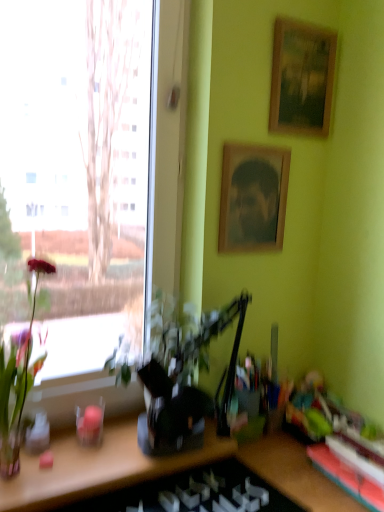
Question: Does wooden picture frame at upper center, positioned as the second picture frame in top-to-bottom order, appear on the right side of rubberized green toy at lower right?

Choices:
 (A) no
 (B) yes

Answer: (A)

Question: Does wooden picture frame at upper center, positioned as the second picture frame in top-to-bottom order, have a smaller size compared to rubberized green toy at lower right?

Choices:
 (A) yes
 (B) no

Answer: (B)

Question: Can you confirm if wooden picture frame at upper center, positioned as the second picture frame in top-to-bottom order, is thinner than rubberized green toy at lower right?

Choices:
 (A) no
 (B) yes

Answer: (B)

Question: Can you confirm if wooden picture frame at upper center, positioned as the second picture frame in top-to-bottom order, is wider than rubberized green toy at lower right?

Choices:
 (A) yes
 (B) no

Answer: (B)

Question: Is wooden picture frame at upper center, positioned as the second picture frame in top-to-bottom order, placed right next to rubberized green toy at lower right?

Choices:
 (A) yes
 (B) no

Answer: (B)

Question: From a real-world perspective, is wooden picture frame at upper center, positioned as the second picture frame in top-to-bottom order, located higher than rubberized green toy at lower right?

Choices:
 (A) no
 (B) yes

Answer: (B)

Question: Can you confirm if green leafy plant at left, which is the 1th houseplant in right-to-left order, is shorter than wooden bookshelf at lower right?

Choices:
 (A) no
 (B) yes

Answer: (A)

Question: Considering the relative sizes of green leafy plant at left, which is the 1th houseplant in right-to-left order, and wooden bookshelf at lower right in the image provided, is green leafy plant at left, which is the 1th houseplant in right-to-left order, bigger than wooden bookshelf at lower right?

Choices:
 (A) yes
 (B) no

Answer: (A)

Question: Considering the relative positions of green leafy plant at left, which is the 1th houseplant in right-to-left order, and wooden bookshelf at lower right in the image provided, is green leafy plant at left, which is the 1th houseplant in right-to-left order, to the right of wooden bookshelf at lower right from the viewer's perspective?

Choices:
 (A) no
 (B) yes

Answer: (A)

Question: Is the surface of green leafy plant at left, which is the 1th houseplant in right-to-left order, in direct contact with wooden bookshelf at lower right?

Choices:
 (A) no
 (B) yes

Answer: (A)

Question: Can you confirm if green leafy plant at left, which is the 1th houseplant in right-to-left order, is thinner than wooden bookshelf at lower right?

Choices:
 (A) no
 (B) yes

Answer: (B)

Question: From the image's perspective, is green leafy plant at left, which is the 1th houseplant in right-to-left order, located above wooden bookshelf at lower right?

Choices:
 (A) yes
 (B) no

Answer: (A)

Question: Is green glossy plant at left, the second houseplant positioned from the right, at the right side of rubberized green toy at lower right?

Choices:
 (A) yes
 (B) no

Answer: (B)